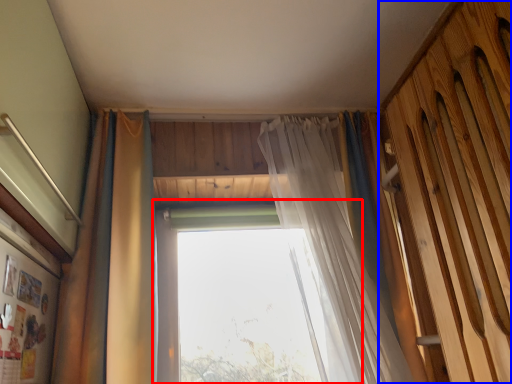
Question: Which point is closer to the camera, window (highlighted by a red box) or barn door (highlighted by a blue box)?

Choices:
 (A) window
 (B) barn door

Answer: (B)